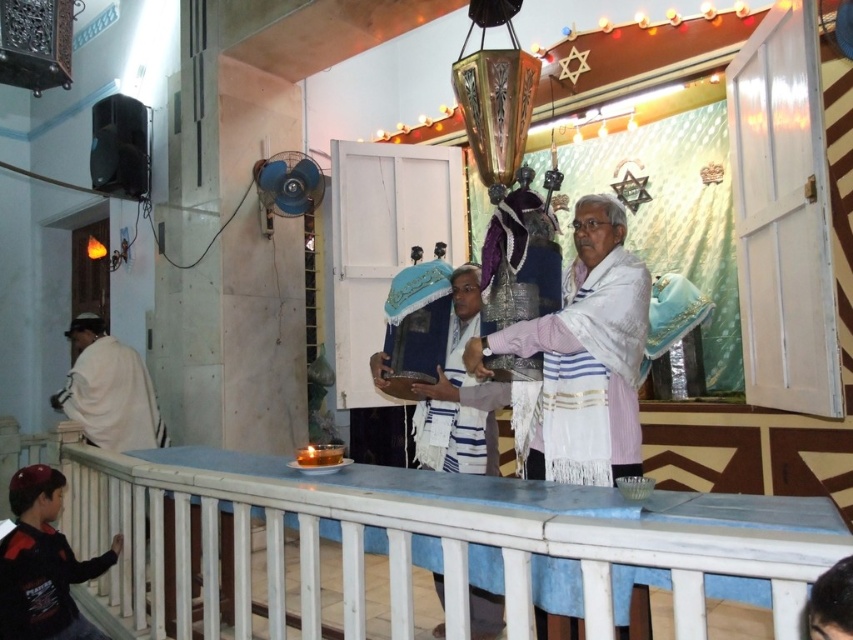
Between point (183, 592) and point (84, 396), which one is positioned in front?

Positioned in front is point (183, 592).

Does white painted wood at lower center have a larger size compared to white cloth at left?

Yes.

Is point (646, 561) positioned after point (90, 404)?

No.

Image resolution: width=853 pixels, height=640 pixels. In order to click on white painted wood at lower center in this screenshot , I will do `click(444, 540)`.

Does white painted wood at lower center come in front of white textured shawl at center?

Yes, white painted wood at lower center is closer to the viewer.

Is white painted wood at lower center to the right of white textured shawl at center from the viewer's perspective?

Incorrect, white painted wood at lower center is not on the right side of white textured shawl at center.

Which is in front, point (202, 524) or point (619, 273)?

Point (202, 524) is more forward.

Image resolution: width=853 pixels, height=640 pixels. Identify the location of white painted wood at lower center. (444, 540).

Is white painted wood at lower center further to the viewer compared to white textured robe at center?

No, it is in front of white textured robe at center.

What do you see at coordinates (444, 540) in the screenshot? I see `white painted wood at lower center` at bounding box center [444, 540].

Does point (611, 593) lie in front of point (437, 412)?

Yes, point (611, 593) is in front of point (437, 412).

At what (x,y) coordinates should I click in order to perform the action: click on white painted wood at lower center. Please return your answer as a coordinate pair (x, y). Image resolution: width=853 pixels, height=640 pixels. Looking at the image, I should click on (444, 540).